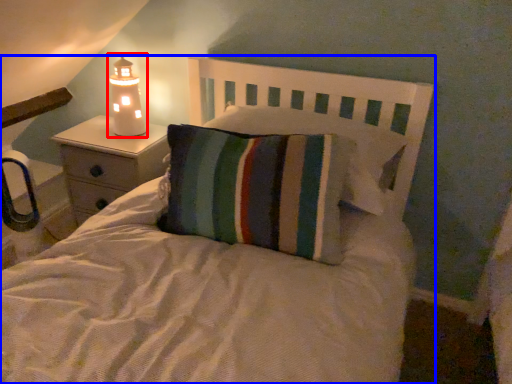
Question: Which point is further to the camera, lamp (highlighted by a red box) or bed (highlighted by a blue box)?

Choices:
 (A) lamp
 (B) bed

Answer: (A)